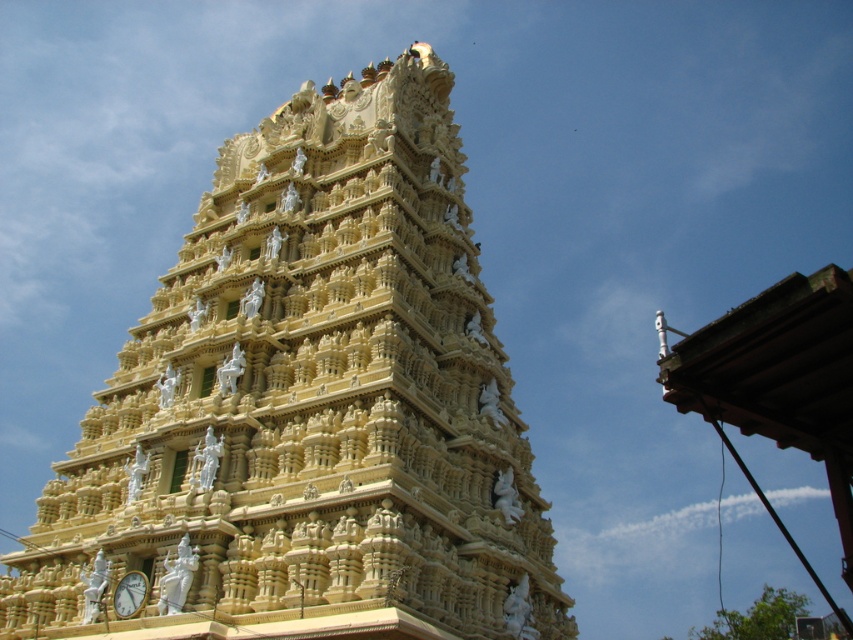
Can you confirm if golden stone temple at center is smaller than metallic gold clock at bottom left?

No.

In the scene shown: Which is below, golden stone temple at center or metallic gold clock at bottom left?

metallic gold clock at bottom left is below.

The height and width of the screenshot is (640, 853). I want to click on golden stone temple at center, so click(308, 406).

This screenshot has height=640, width=853. Identify the location of golden stone temple at center. (308, 406).